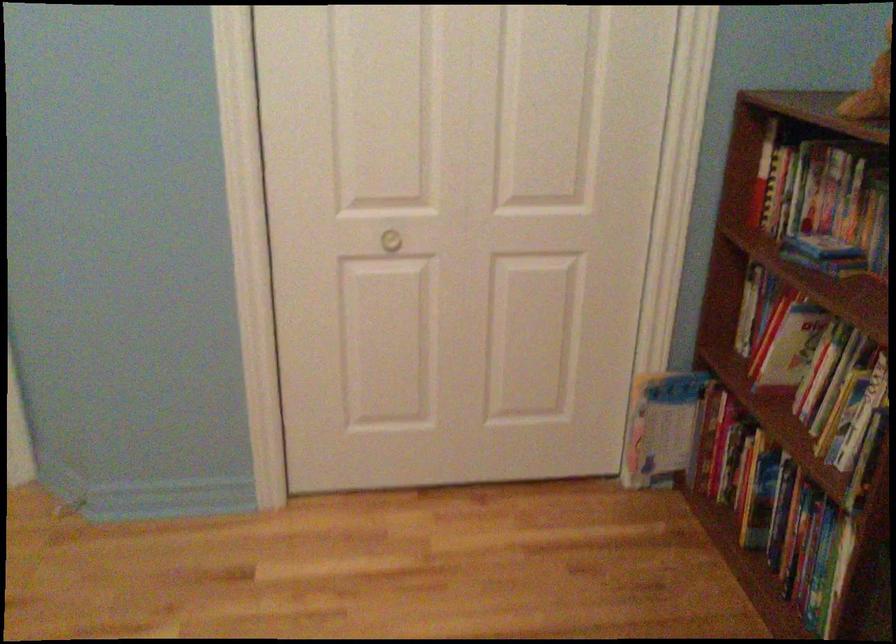
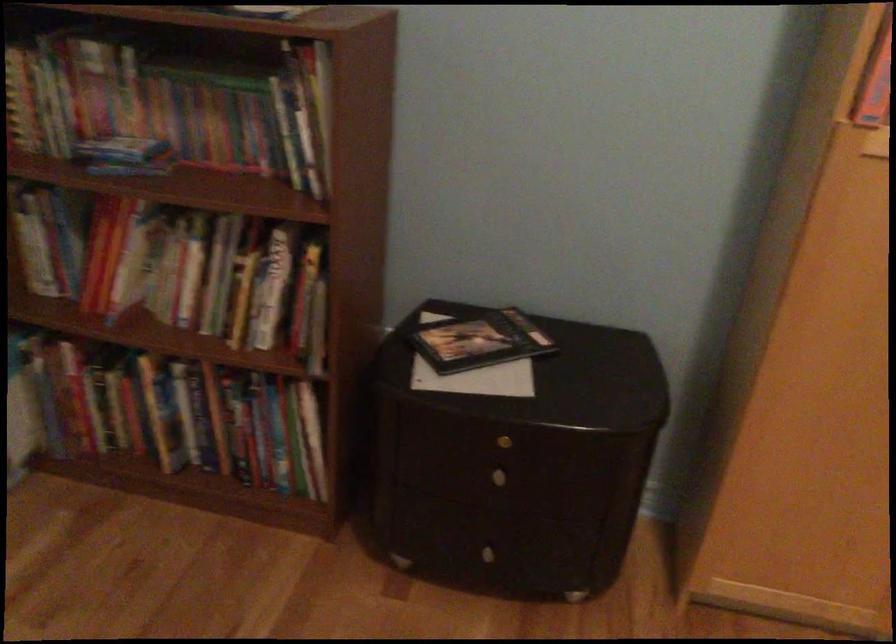
From the picture: The first image is from the beginning of the video and the second image is from the end. How did the camera likely rotate when shooting the video?

The camera's rotation is toward right-down.